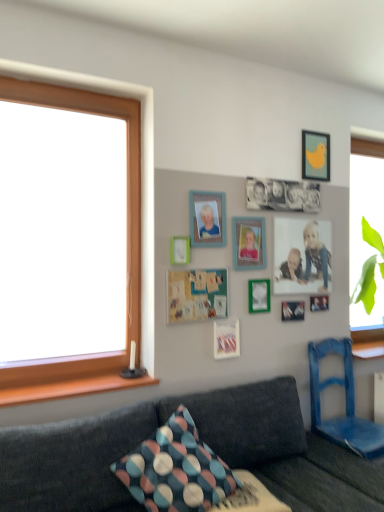
Question: From a real-world perspective, is matte white picture frame at center, the 1th picture frame in the left-to-right sequence, physically below metallic silver frame at center, the 3th decorative picture when ordered from top to bottom?

Choices:
 (A) yes
 (B) no

Answer: (B)

Question: Could you tell me if matte white picture frame at center, acting as the sixth picture frame starting from the right, is facing metallic silver frame at center, which is the second decorative picture from right to left?

Choices:
 (A) no
 (B) yes

Answer: (A)

Question: Can you confirm if matte white picture frame at center, acting as the sixth picture frame starting from the right, is positioned to the right of metallic silver frame at center, positioned as the 2th decorative picture in bottom-to-top order?

Choices:
 (A) yes
 (B) no

Answer: (B)

Question: Is there a large distance between matte white picture frame at center, the 1th picture frame in the left-to-right sequence, and metallic silver frame at center, arranged as the 3th decorative picture when viewed from the left?

Choices:
 (A) yes
 (B) no

Answer: (B)

Question: From the image's perspective, is matte white picture frame at center, acting as the sixth picture frame starting from the right, on metallic silver frame at center, arranged as the 3th decorative picture when viewed from the left?

Choices:
 (A) yes
 (B) no

Answer: (A)

Question: Considering the relative sizes of matte white picture frame at center, acting as the sixth picture frame starting from the right, and metallic silver frame at center, arranged as the 3th decorative picture when viewed from the left, in the image provided, is matte white picture frame at center, acting as the sixth picture frame starting from the right, thinner than metallic silver frame at center, arranged as the 3th decorative picture when viewed from the left,?

Choices:
 (A) yes
 (B) no

Answer: (B)

Question: Is matte wooden frame at lower right, the 2th decorative picture in the top-to-bottom sequence, completely or partially inside black matte photograph at center, which appears as the fourth decorative picture when ordered from the bottom?

Choices:
 (A) no
 (B) yes

Answer: (A)

Question: Is black matte photograph at center, which appears as the fourth decorative picture when ordered from the bottom, closer to the viewer compared to matte wooden frame at lower right, placed as the 3th decorative picture when sorted from bottom to top?

Choices:
 (A) no
 (B) yes

Answer: (B)

Question: Does black matte photograph at center, the third decorative picture positioned from the right, come behind matte wooden frame at lower right, placed as the 3th decorative picture when sorted from bottom to top?

Choices:
 (A) yes
 (B) no

Answer: (B)

Question: Are black matte photograph at center, the first decorative picture when ordered from top to bottom, and matte wooden frame at lower right, placed as the 3th decorative picture when sorted from bottom to top, far apart?

Choices:
 (A) no
 (B) yes

Answer: (A)

Question: From the image's perspective, is black matte photograph at center, the third decorative picture positioned from the right, on matte wooden frame at lower right, placed as the 3th decorative picture when sorted from bottom to top?

Choices:
 (A) yes
 (B) no

Answer: (A)

Question: From a real-world perspective, is black matte photograph at center, which ranks as the second decorative picture in left-to-right order, located higher than matte wooden frame at lower right, placed as the 3th decorative picture when sorted from bottom to top?

Choices:
 (A) yes
 (B) no

Answer: (A)

Question: Can you confirm if matte plastic photo frame at upper center, the second picture frame positioned from the left, is shorter than green matte picture frame at center, which is the 3th picture frame from right to left?

Choices:
 (A) yes
 (B) no

Answer: (B)